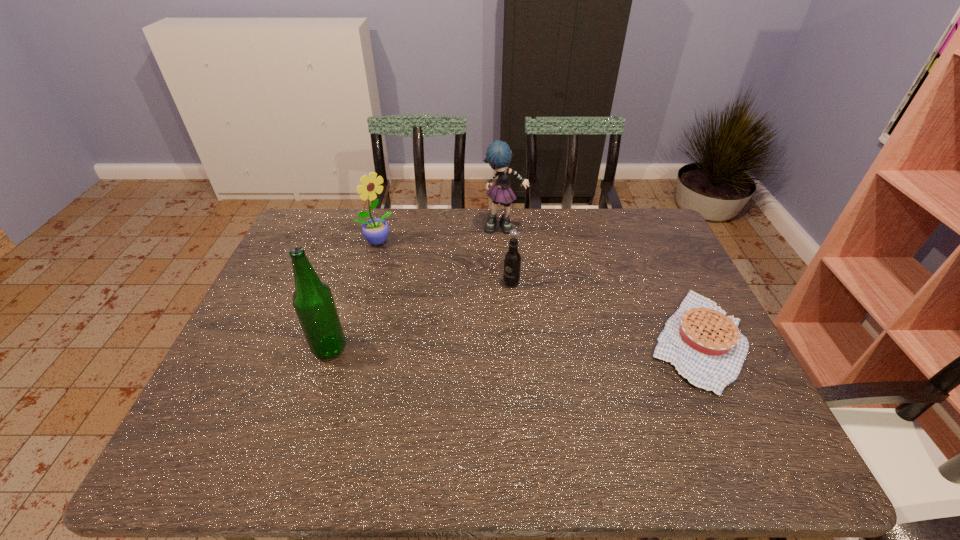
This screenshot has height=540, width=960. In the image, there is a desktop. In order to click on free space at the near right corner in this screenshot , I will do `click(696, 412)`.

Find the location of a particular element. This screenshot has height=540, width=960. unoccupied position between the third shortest object and the rag doll is located at coordinates (440, 234).

Locate an element on the screen. empty space that is in between the third farthest object and the third tallest object is located at coordinates (444, 262).

Identify the location of vacant space that is in between the shortest object and the rag doll. (x=601, y=284).

Find the location of `vacant region between the sunflower and the shortest object`. vacant region between the sunflower and the shortest object is located at coordinates (537, 291).

Identify the location of free space between the sunflower and the rightmost object. (537, 291).

This screenshot has width=960, height=540. Find the location of `empty location between the third tallest object and the root beer`. empty location between the third tallest object and the root beer is located at coordinates (444, 262).

Identify the location of vacant area between the third tallest object and the beer bottle. (353, 295).

Where is `free spot between the root beer and the sunflower`? The image size is (960, 540). free spot between the root beer and the sunflower is located at coordinates (444, 262).

Identify the location of free space between the third tallest object and the pie. The width and height of the screenshot is (960, 540). (537, 291).